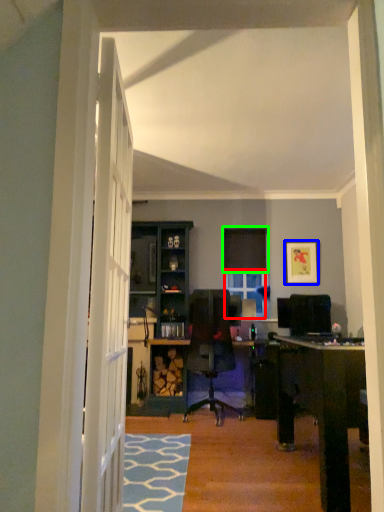
Question: Estimate the real-world distances between objects in this image. Which object is farther from window (highlighted by a red box), picture frame (highlighted by a blue box) or curtain (highlighted by a green box)?

Choices:
 (A) picture frame
 (B) curtain

Answer: (A)